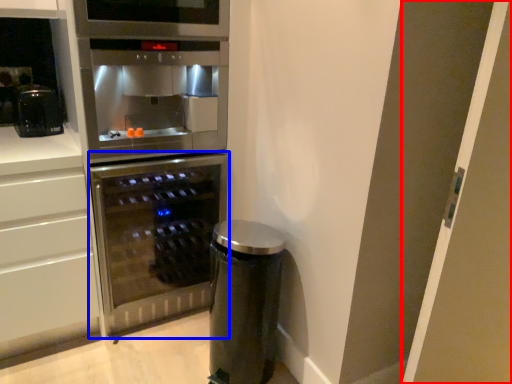
Question: Which object appears closest to the camera in this image, glass door (highlighted by a red box) or home appliance (highlighted by a blue box)?

Choices:
 (A) glass door
 (B) home appliance

Answer: (A)